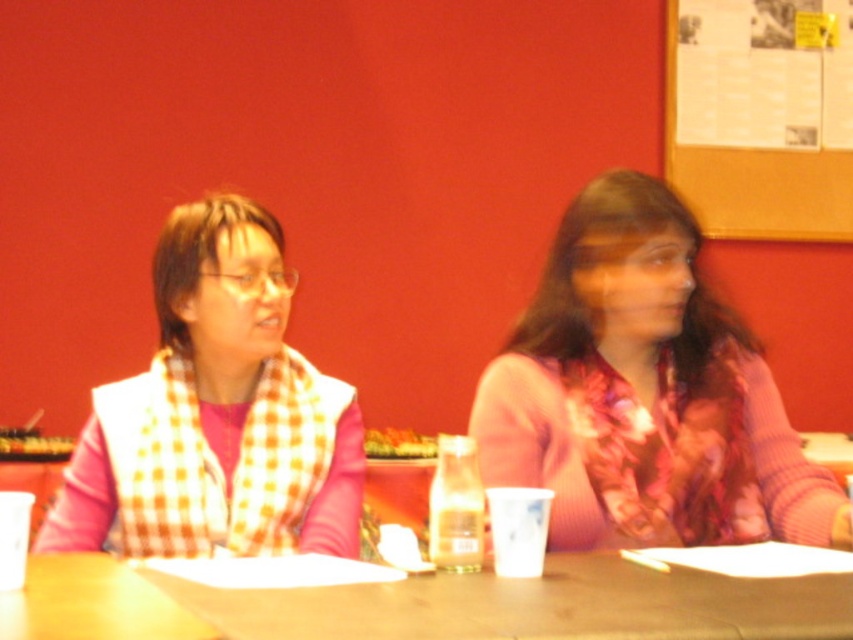
Does floral scarf at center appear on the right side of corkboard at upper right?

In fact, floral scarf at center is to the left of corkboard at upper right.

Who is lower down, floral scarf at center or corkboard at upper right?

floral scarf at center

Does point (801, 493) lie in front of point (706, 177)?

Yes.

At what (x,y) coordinates should I click in order to perform the action: click on floral scarf at center. Please return your answer as a coordinate pair (x, y). The image size is (853, 640). Looking at the image, I should click on (643, 394).

Which of these two, checkered scarf at left or corkboard at upper right, stands shorter?

checkered scarf at left is shorter.

Is checkered scarf at left smaller than corkboard at upper right?

Correct, checkered scarf at left occupies less space than corkboard at upper right.

The height and width of the screenshot is (640, 853). Find the location of `checkered scarf at left`. checkered scarf at left is located at coordinates (218, 410).

Who is positioned more to the left, floral scarf at center or wooden table at center?

Positioned to the left is wooden table at center.

Who is more distant from viewer, (759, 468) or (720, 621)?

The point (759, 468) is behind.

Image resolution: width=853 pixels, height=640 pixels. What are the coordinates of `floral scarf at center` in the screenshot? It's located at (643, 394).